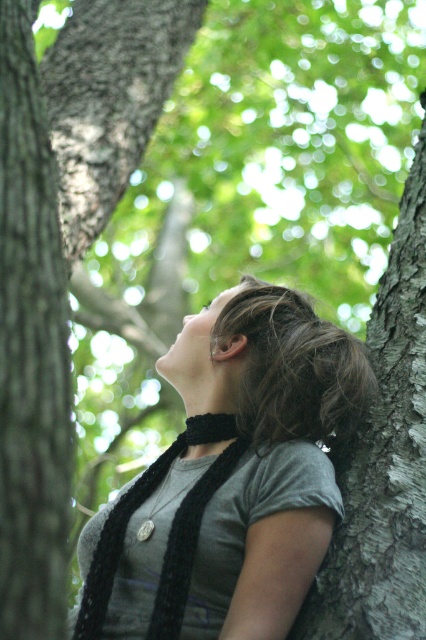
You are an artist sketching the scene and need to locate the smooth brown bark at left. According to the coordinates provided, where exactly should you look on your canvas?

You should look at point (31, 349) on your canvas to find the smooth brown bark at left.